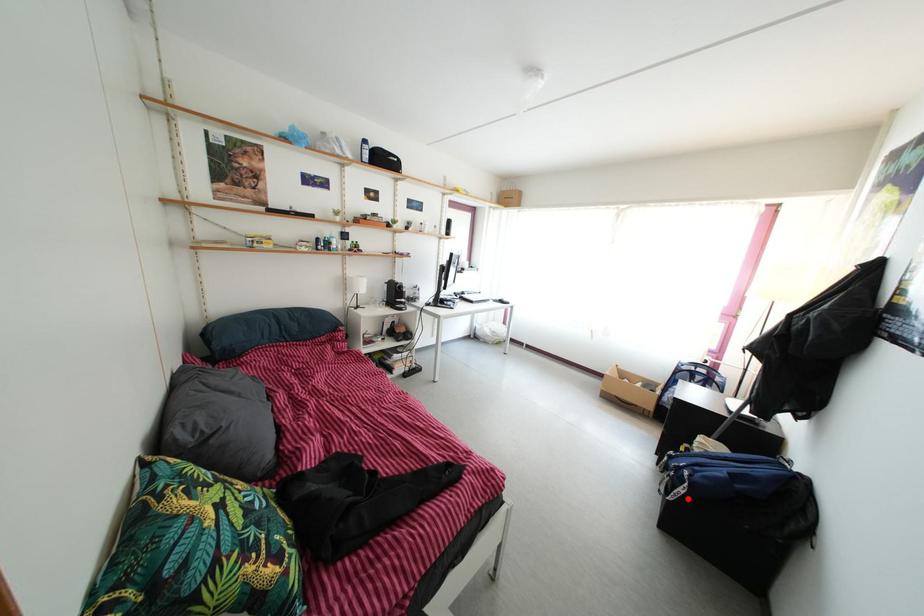
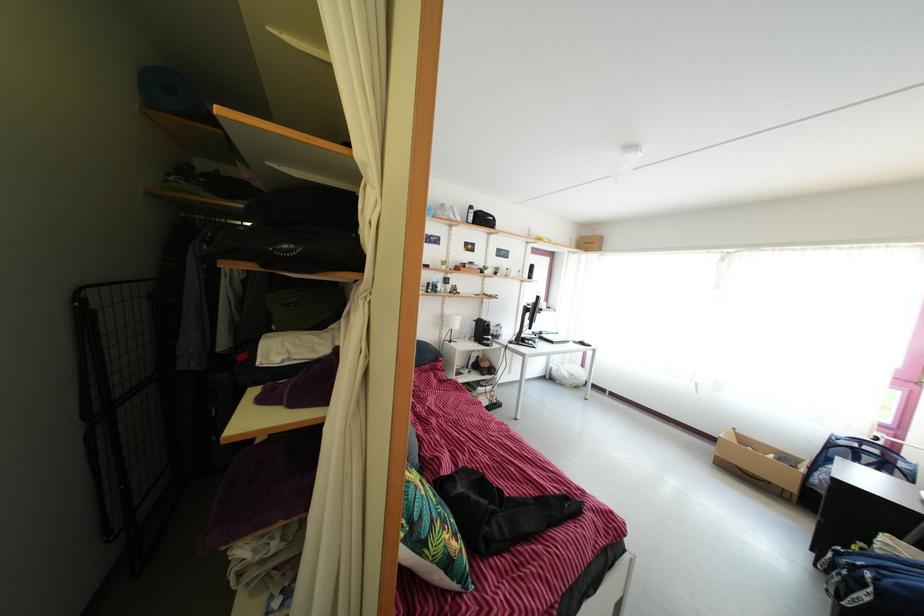
Question: A red point is marked in image1. In image2, is the corresponding 3D point closer to the camera or farther? Reply with the corresponding letter.

Choices:
 (A) The corresponding 3D point is closer.
 (B) The corresponding 3D point is farther.

Answer: (A)